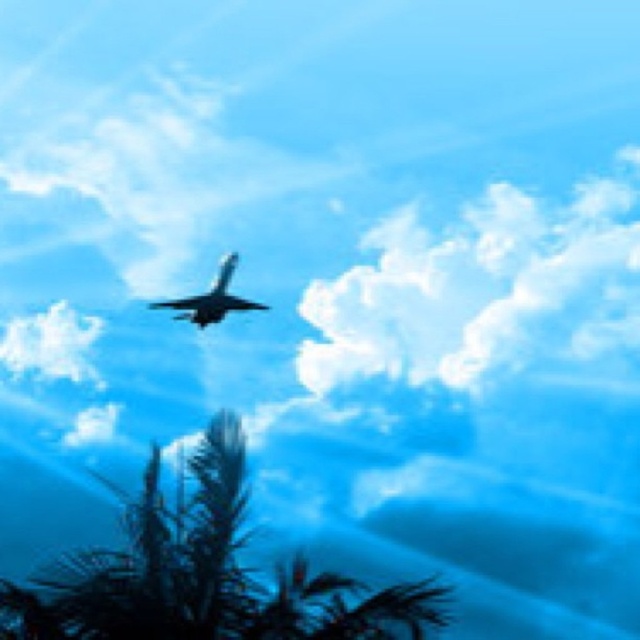
Question: Does white fluffy cloud at upper center have a smaller size compared to green leafy tree at lower center?

Choices:
 (A) no
 (B) yes

Answer: (A)

Question: Is green leafy tree at lower center above shiny silver airplane at center?

Choices:
 (A) no
 (B) yes

Answer: (A)

Question: Is white fluffy cloud at upper center positioned at the back of green leafy tree at lower center?

Choices:
 (A) no
 (B) yes

Answer: (B)

Question: Which point appears farthest from the camera in this image?

Choices:
 (A) (186, 316)
 (B) (432, 285)
 (C) (234, 556)

Answer: (B)

Question: Which object appears farthest from the camera in this image?

Choices:
 (A) shiny silver airplane at center
 (B) white fluffy cloud at upper center

Answer: (A)

Question: Which object is positioned farthest from the shiny silver airplane at center?

Choices:
 (A) green leafy tree at lower center
 (B) white fluffy cloud at upper center

Answer: (A)